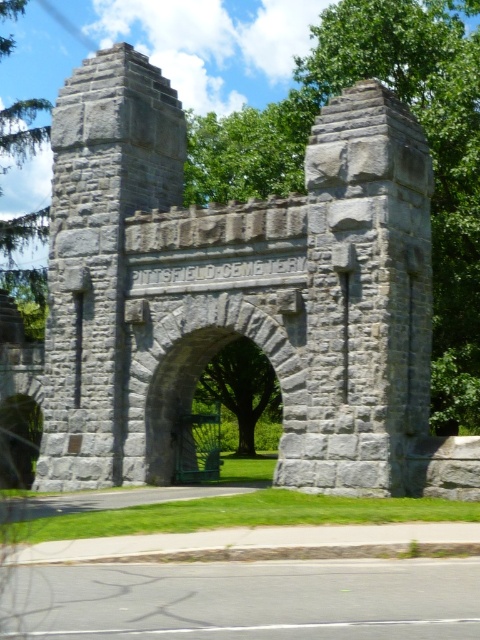
Question: Observing the image, what is the correct spatial positioning of gray stone gate at center in reference to gray stone archway at center?

Choices:
 (A) left
 (B) right

Answer: (A)

Question: Which of the following is the closest to the observer?

Choices:
 (A) gray stone archway at center
 (B) gray stone gate at center

Answer: (B)

Question: Can you confirm if gray stone gate at center is positioned to the left of gray stone archway at center?

Choices:
 (A) yes
 (B) no

Answer: (A)

Question: Does gray stone gate at center lie in front of gray stone archway at center?

Choices:
 (A) no
 (B) yes

Answer: (B)